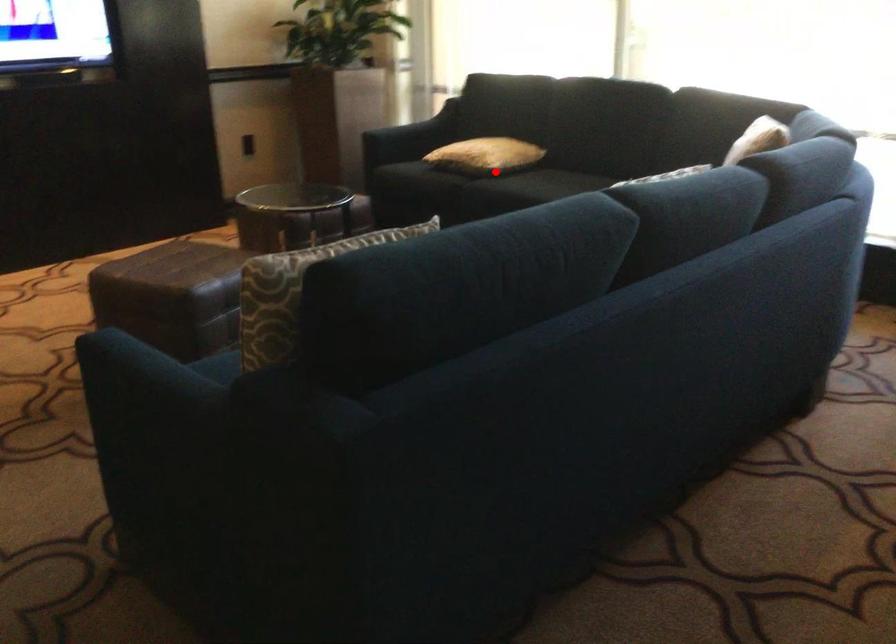
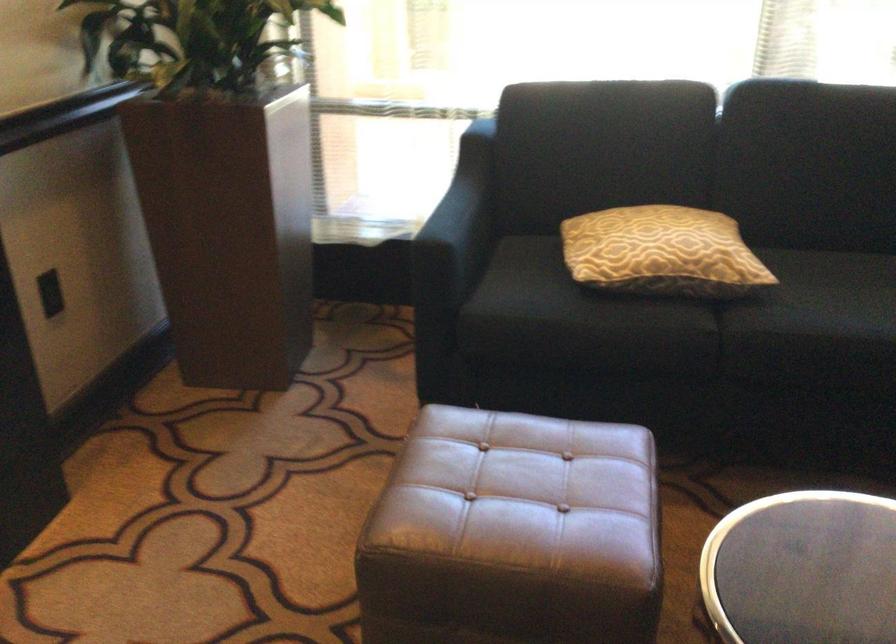
Locate, in the second image, the point that corresponds to the highlighted location in the first image.

(752, 289)